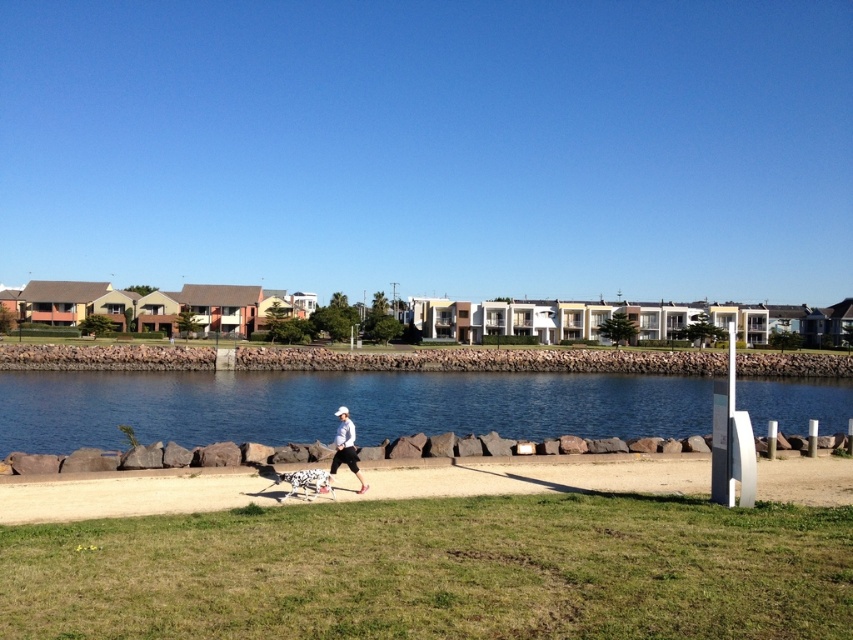
Which is in front, point (201, 442) or point (349, 420)?

Point (349, 420)

Is point (270, 422) positioned behind point (347, 420)?

That is True.

Identify the location of blue stone water at center. This screenshot has height=640, width=853. (337, 404).

The width and height of the screenshot is (853, 640). In order to click on blue stone water at center in this screenshot , I will do `click(337, 404)`.